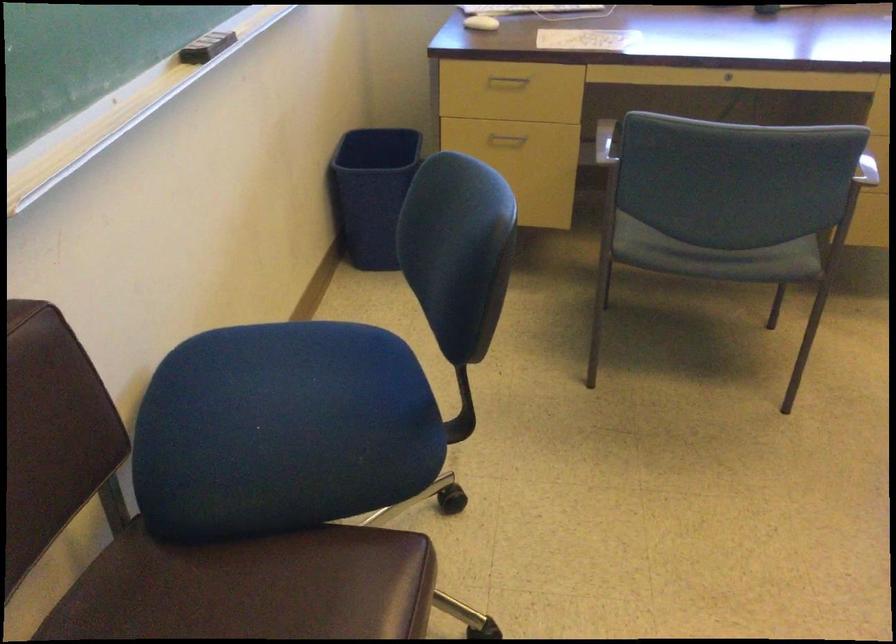
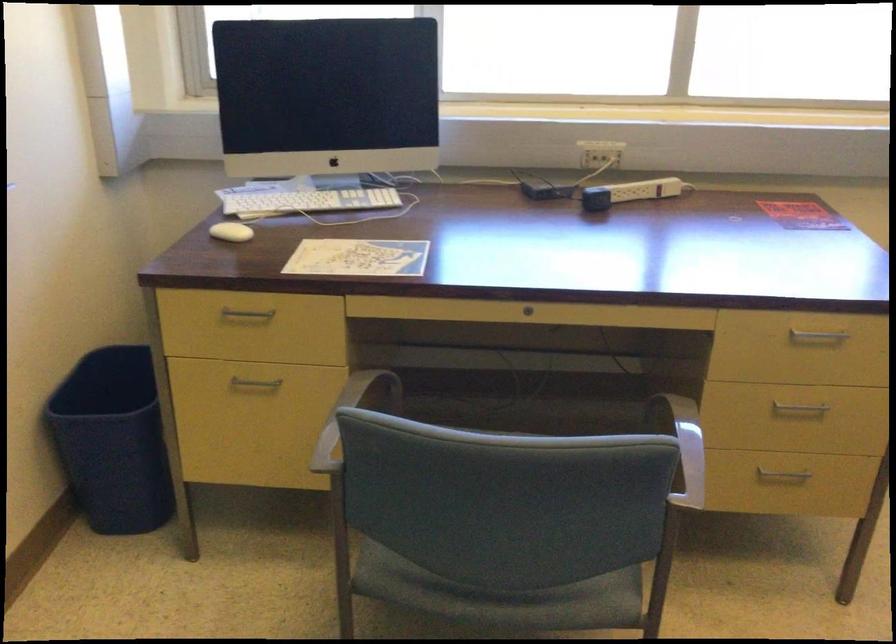
The point at (378, 189) is marked in the first image. Where is the corresponding point in the second image?

(113, 440)